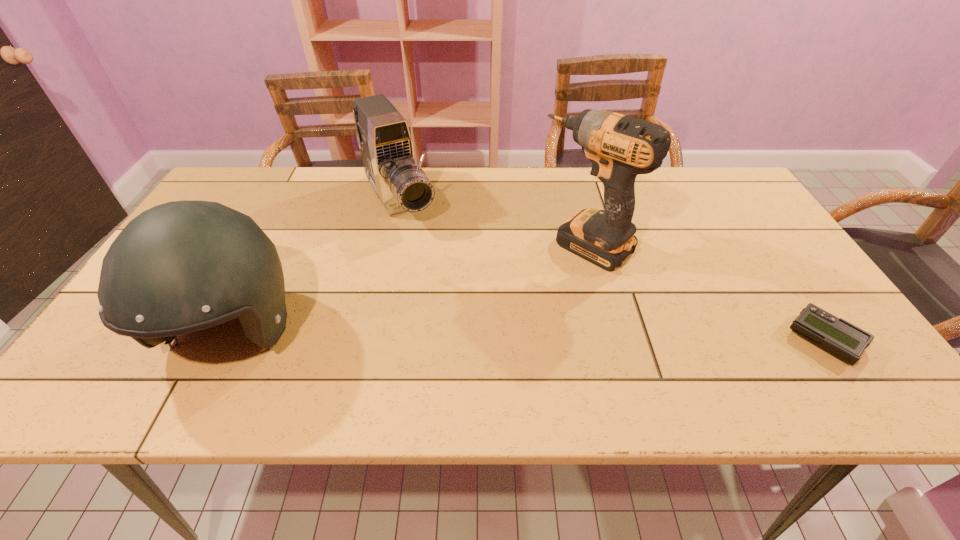
Image resolution: width=960 pixels, height=540 pixels. I want to click on free space between the leftmost object and the second object from right to left, so click(x=409, y=289).

The height and width of the screenshot is (540, 960). What are the coordinates of `free spot between the rightmost object and the third object from left to right` in the screenshot? It's located at (706, 292).

Locate an element on the screen. The height and width of the screenshot is (540, 960). free spot between the leftmost object and the second shortest object is located at coordinates tap(316, 267).

Identify the location of free spot between the beeper and the drill. (x=706, y=292).

The height and width of the screenshot is (540, 960). What are the coordinates of `vacant point located between the shortest object and the football helmet` in the screenshot? It's located at [528, 336].

Locate which object is the second closest to the third tallest object. Please provide its 2D coordinates. Your answer should be formatted as a tuple, i.e. [(x, y)], where the tuple contains the x and y coordinates of a point satisfying the conditions above.

[(620, 147)]

Locate an element on the screen. the closest object to the drill is located at coordinates (383, 136).

Identify the location of free space in the image that satisfies the following two spatial constraints: 1. on the front side of the beeper; 2. on the left side of the camcorder. This screenshot has height=540, width=960. (371, 340).

Locate an element on the screen. The height and width of the screenshot is (540, 960). vacant space that satisfies the following two spatial constraints: 1. on the front side of the drill; 2. on the left side of the third tallest object is located at coordinates (391, 244).

This screenshot has height=540, width=960. In order to click on vacant point that satisfies the following two spatial constraints: 1. at the face opening of the leftmost object; 2. on the left side of the rightmost object in this screenshot , I will do `click(228, 340)`.